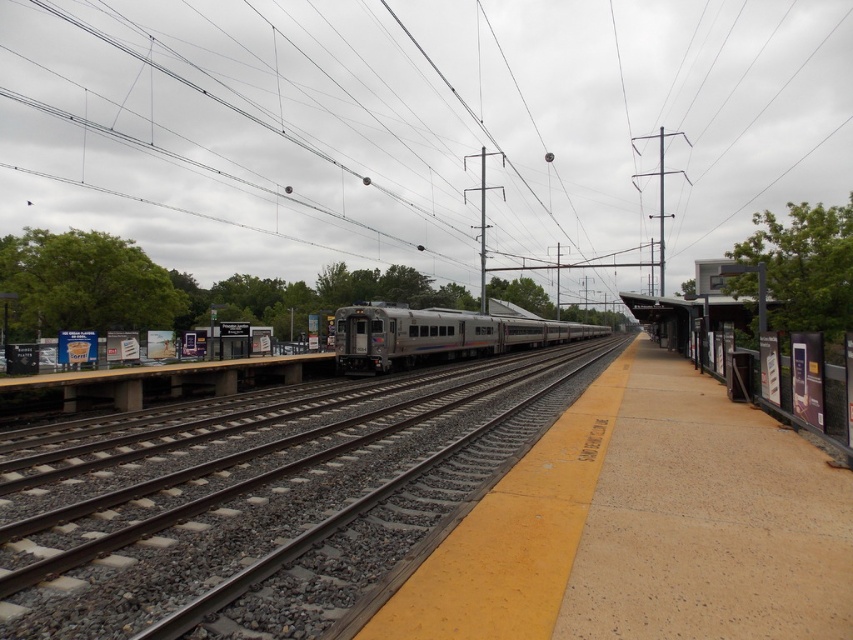
You are a maintenance worker at the train station. You need to inspect both the metallic wires at center and the silver metallic train at center. Which object is taller and requires a ladder to reach?

The metallic wires at center has a greater height compared to the silver metallic train at center, so you need a ladder to reach the metallic wires at center.

Based on the photo, you are a maintenance worker at the train station and need to locate the metallic wires at center for inspection. According to the coordinates provided, where exactly should you look on the platform?

The metallic wires at center are located at point coordinates of 0.194 on the x axis and 0.495 on the y axis.